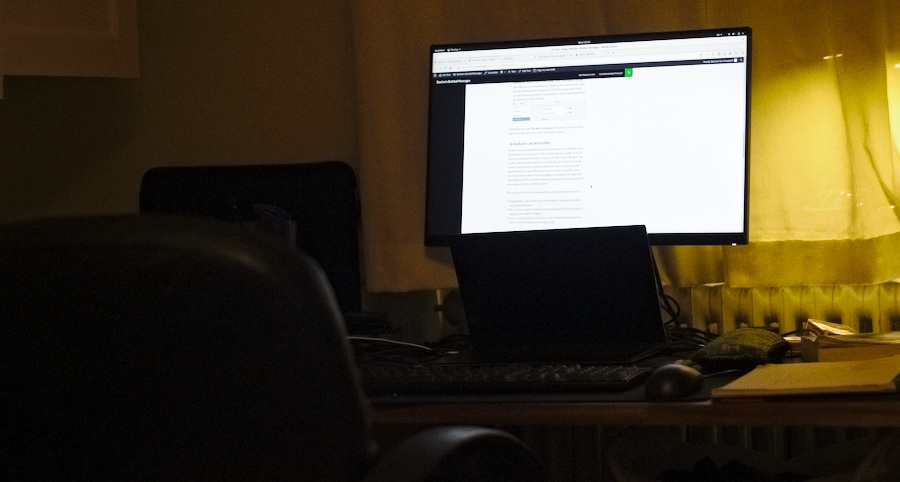
What are the coordinates of `curtain` in the screenshot? It's located at (777, 160).